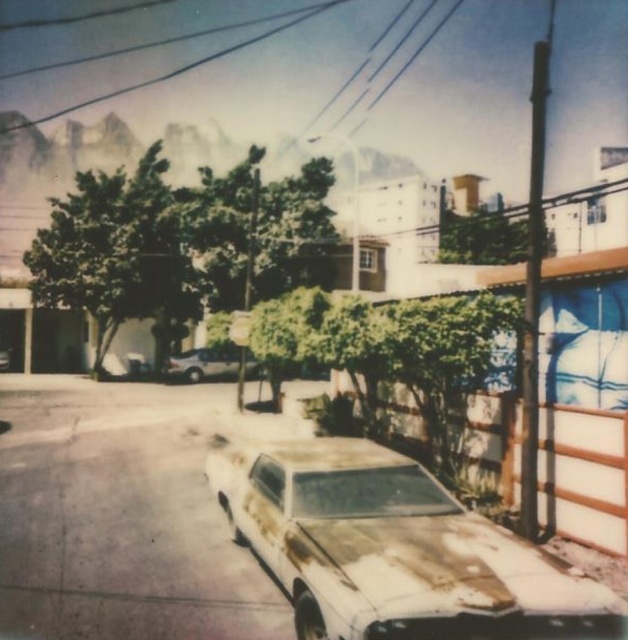
You are standing on the sidewalk and see the rusty metal car at lower center. If you want to walk to the car, how many steps would you need to take, assuming each step is about 3 feet long?

The distance between you and the rusty metal car at lower center is 16.62 feet. Since each step is about 3 feet, you would need approximately 6 steps to reach the car.

You are standing at the point marked by coordinates (394, 548) in the image. What object is located exactly at this point?

The point at coordinates (394, 548) corresponds to the rusty metal car at lower center.

You are a city planner assessing the space between the rusty metal car at lower center and the rusty metallic car at center for potential parking. Can the space between them accommodate a standard compact car?

The rusty metal car at lower center is wider than the rusty metallic car at center. However, the question is about the space between them, not their widths. Since the description only provides information about their widths, we cannot determine if the space between them is sufficient for a standard compact car based on the given data.